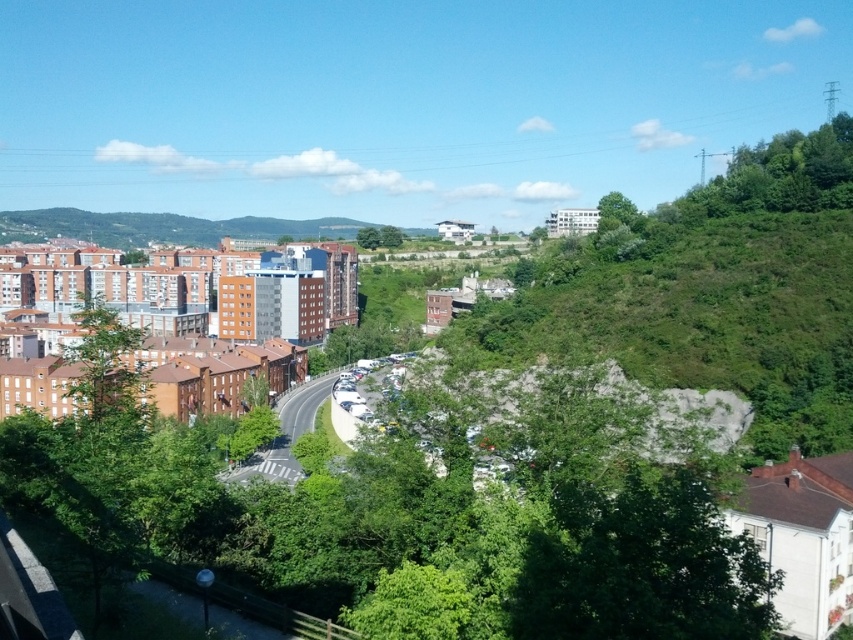
You are standing in the middle of the road and want to walk towards the buildings on the left. Which direction should you go relative to the green leafy tree at left and the green leafy tree at upper right?

You should walk towards the left direction relative to the green leafy tree at left because it is positioned to the left of the green leafy tree at upper right, meaning the buildings are in that direction.

You are standing in the middle of the road and looking towards the orange brick buildings at left and the green leafy tree at left. Which one appears taller in the scene?

The orange brick buildings at left are taller than the green leafy tree at left according to the description.

Based on the scene description, which object occupies more horizontal space in the image? The orange brick buildings at left or the green leafy tree at upper right?

The orange brick buildings at left might be wider than green leafy tree at upper right according to the description.